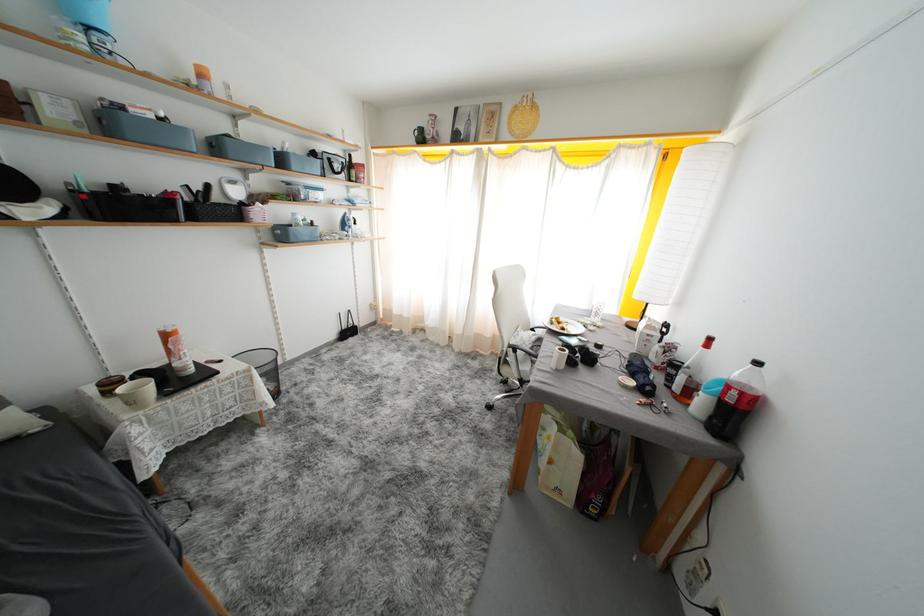
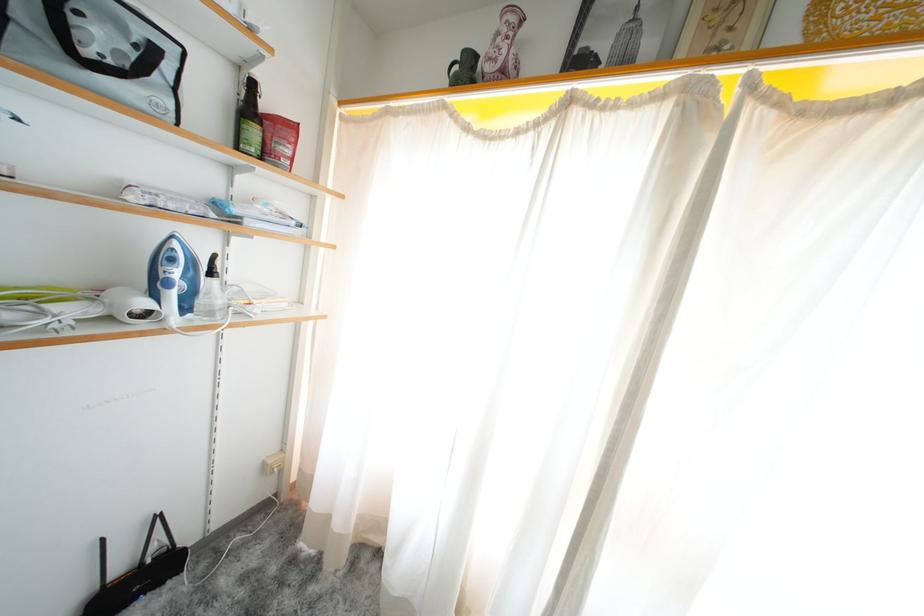
The point at (x=355, y=336) is marked in the first image. Where is the corresponding point in the second image?

(143, 586)